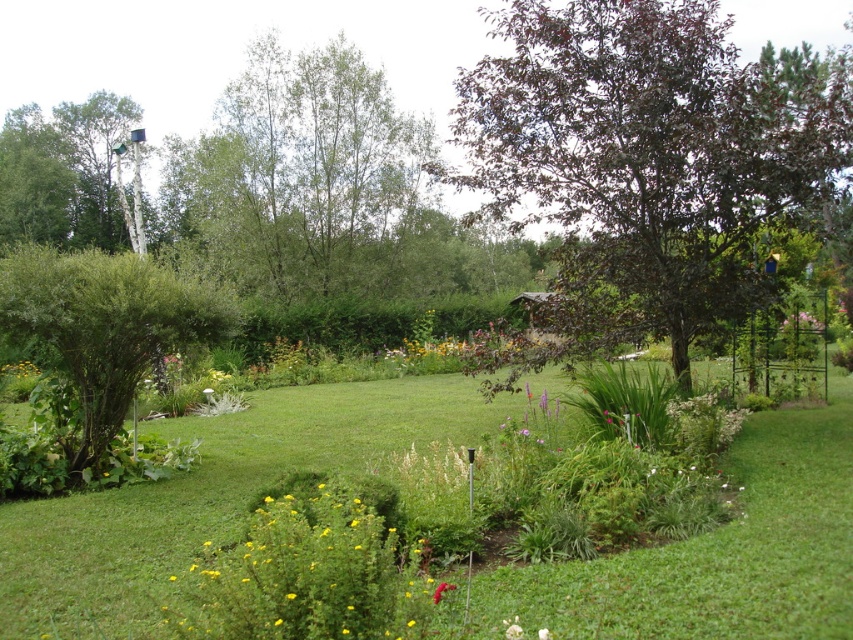
Can you confirm if green leafy bush at left is positioned below yellow matte flower at center?

No.

Where is `green leafy bush at left`? The height and width of the screenshot is (640, 853). green leafy bush at left is located at coordinates (99, 333).

Based on the photo, who is positioned more to the right, green leafy bush at left or pink matte flower at upper right?

pink matte flower at upper right is more to the right.

Does point (85, 321) lie in front of point (822, 323)?

That is True.

Image resolution: width=853 pixels, height=640 pixels. Identify the location of green leafy bush at left. (99, 333).

At what (x,y) coordinates should I click in order to perform the action: click on green leafy bush at left. Please return your answer as a coordinate pair (x, y). The width and height of the screenshot is (853, 640). Looking at the image, I should click on (99, 333).

Who is positioned more to the right, yellow-green foliage at center or bright yellow flower at center?

bright yellow flower at center

Is yellow-green foliage at center thinner than bright yellow flower at center?

No.

Does point (337, 554) come closer to viewer compared to point (451, 586)?

Yes.

You are a GUI agent. You are given a task and a screenshot of the screen. Output one action in this format:
    pyautogui.click(x=<x>, y=<y>)
    Task: Click on the yellow-green foliage at center
    The width and height of the screenshot is (853, 640).
    Given the screenshot: What is the action you would take?
    pyautogui.click(x=312, y=573)